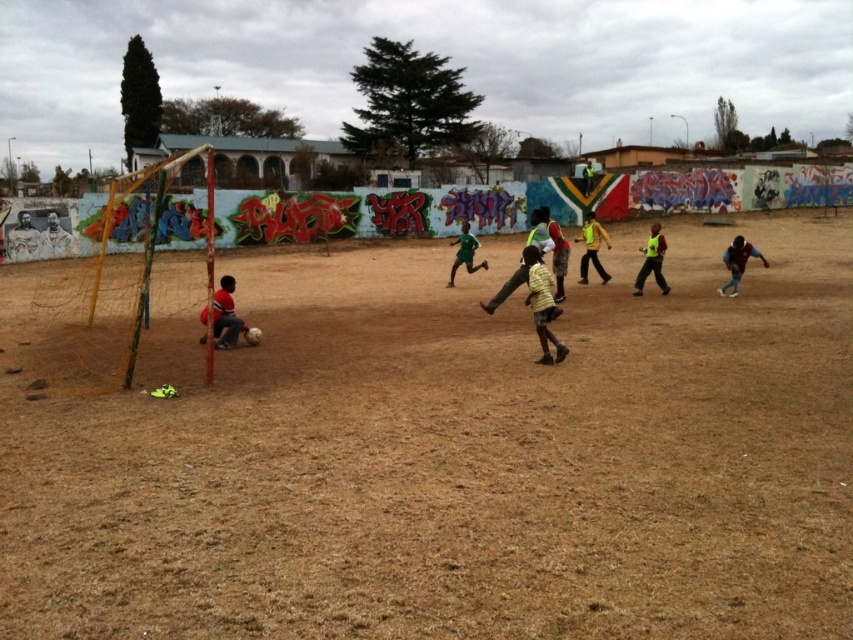
You are a photographer trying to capture both the yellow matte shirt at center and the maroon jersey at right in a single shot. Given that the camera can only focus on objects of a certain size, which player should you adjust your focus for to ensure both are in the frame?

The yellow matte shirt at center is smaller than the maroon jersey at right, so you should focus on the maroon jersey at right to ensure both are in the frame.

You are a photographer trying to capture a clear shot of both the yellow matte shirt at center and the green matte shirt at center during the soccer game. Since both are at the center, which one might be partially hidden by the other?

The yellow matte shirt at center is positioned under the green matte shirt at center, so the yellow one might be partially hidden by the green one.

In the scene shown: You are a photographer trying to capture a soccer game. You notice two players wearing a yellow matte shirt at center and a maroon jersey at right. Based on their positions and heights, which player would likely be in the foreground of your photo?

The yellow matte shirt at center would be in the foreground because it is much taller than the maroon jersey at right, making it appear closer to the camera.